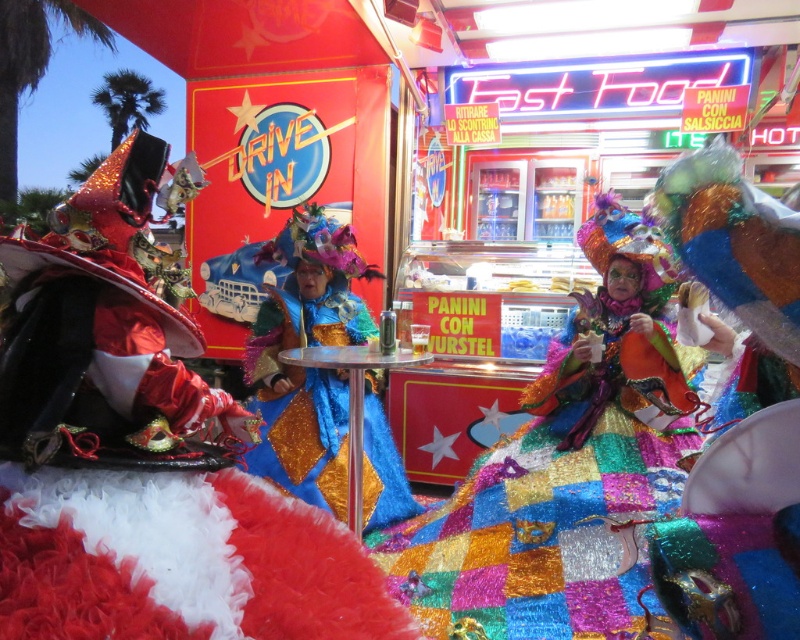
Question: Observing the image, what is the correct spatial positioning of shiny sequined dress at center in reference to shiny blue fabric dress at center?

Choices:
 (A) above
 (B) below

Answer: (B)

Question: Is shiny red fabric at left positioned before shiny blue fabric dress at center?

Choices:
 (A) no
 (B) yes

Answer: (B)

Question: Which point is farther from the camera taking this photo?

Choices:
 (A) (314, 211)
 (B) (640, 417)

Answer: (A)

Question: Can you confirm if shiny sequined dress at center is bigger than shiny blue fabric dress at center?

Choices:
 (A) no
 (B) yes

Answer: (B)

Question: Based on their relative distances, which object is farther from the shiny sequined dress at center?

Choices:
 (A) shiny red fabric at left
 (B) shiny blue fabric dress at center

Answer: (A)

Question: Which object is the farthest from the shiny blue fabric dress at center?

Choices:
 (A) shiny sequined dress at center
 (B) shiny red fabric at left

Answer: (B)